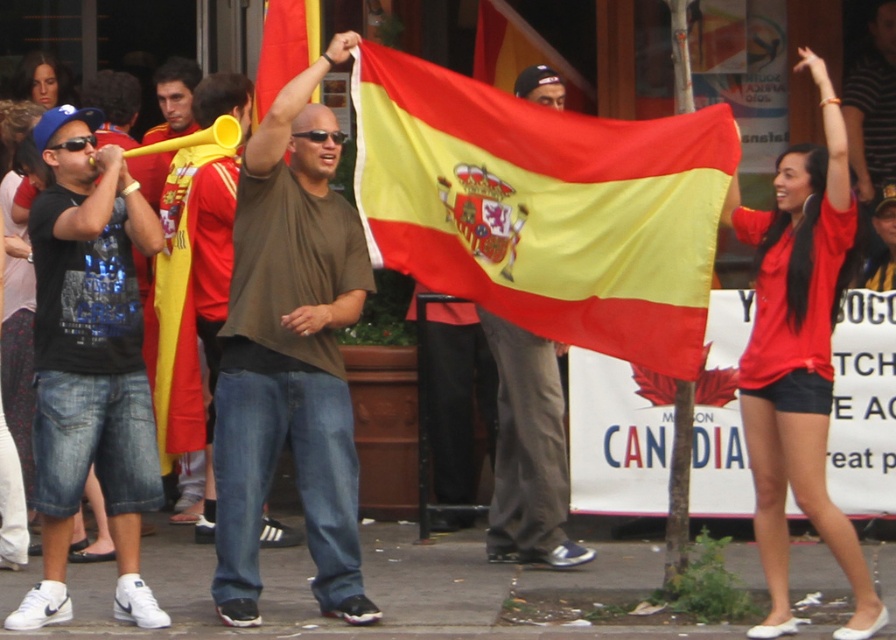
You are a photographer aiming to capture the silky fabric flag at center and the matte red shirt at center in a single shot. Which object should you focus on first to ensure both are in frame?

The silky fabric flag at center is located above the matte red shirt at center, so you should focus on the matte red shirt at center first to ensure both are in frame.

Looking at this image, the point at coordinates (290, 353) is located on which object in the scene?

The point at coordinates (290, 353) is located on the brown cotton shirt at center.